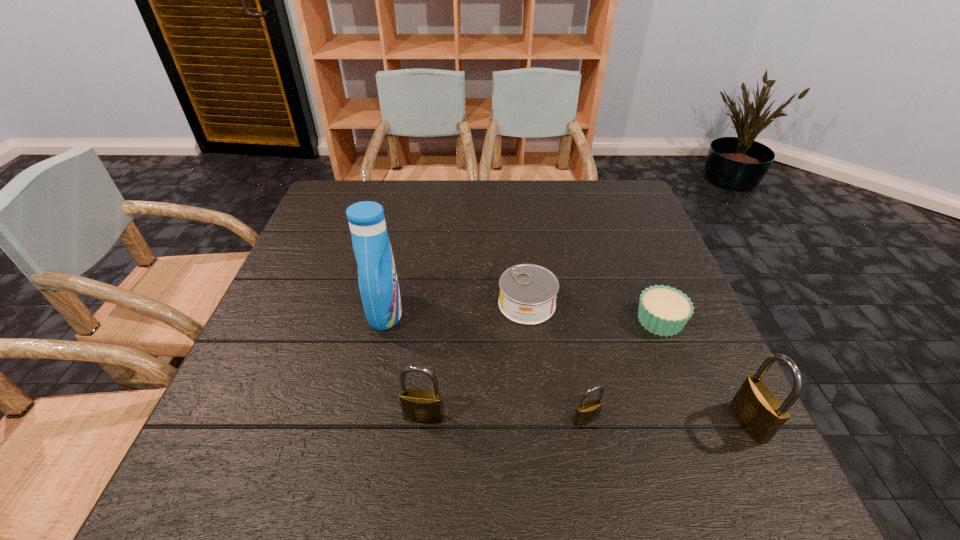
At what (x,y) coordinates should I click in order to perform the action: click on free spot at the left edge of the desktop. Please return your answer as a coordinate pair (x, y). Looking at the image, I should click on (307, 290).

Image resolution: width=960 pixels, height=540 pixels. I want to click on free space at the right edge of the desktop, so click(x=682, y=361).

In the image, there is a desktop. At what (x,y) coordinates should I click in order to perform the action: click on free region at the near left corner. Please return your answer as a coordinate pair (x, y). The width and height of the screenshot is (960, 540). Looking at the image, I should click on (264, 409).

Identify the location of vacant space at the far right corner of the desktop. (589, 193).

In the image, there is a desktop. Where is `vacant space at the near right corner`? The height and width of the screenshot is (540, 960). vacant space at the near right corner is located at coordinates (714, 402).

I want to click on vacant region between the second padlock from right to left and the rightmost padlock, so point(667,421).

Identify the location of blank region between the shortest padlock and the can. (556, 362).

Identify the location of empty space that is in between the tallest object and the rightmost padlock. (566, 368).

Find the location of `vacant space that's between the fourth tallest object and the second shortest padlock`. vacant space that's between the fourth tallest object and the second shortest padlock is located at coordinates (505, 418).

At what (x,y) coordinates should I click in order to perform the action: click on free space between the can and the leftmost object. Please return your answer as a coordinate pair (x, y). Looking at the image, I should click on (456, 308).